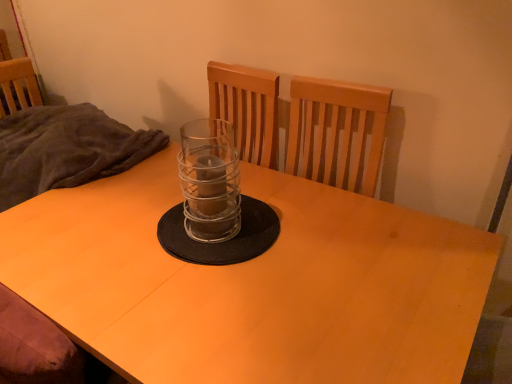
Question: From a real-world perspective, is dark gray fabric at left above or below clear glass candle holder at center?

Choices:
 (A) above
 (B) below

Answer: (B)

Question: Is dark gray fabric at left wider or thinner than clear glass candle holder at center?

Choices:
 (A) thin
 (B) wide

Answer: (B)

Question: Based on their relative distances, which object is farther from the dark gray fabric at left?

Choices:
 (A) matte wood desk at center
 (B) clear glass candle holder at center

Answer: (B)

Question: Which object is positioned farthest from the dark gray fabric at left?

Choices:
 (A) matte wood desk at center
 (B) clear glass candle holder at center

Answer: (B)